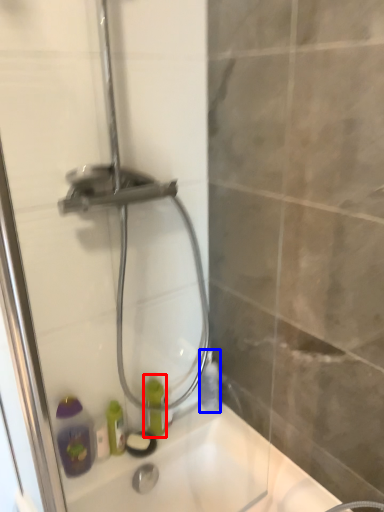
Question: Among these objects, which one is farthest to the camera, bottle (highlighted by a red box) or bottle (highlighted by a blue box)?

Choices:
 (A) bottle
 (B) bottle

Answer: (B)